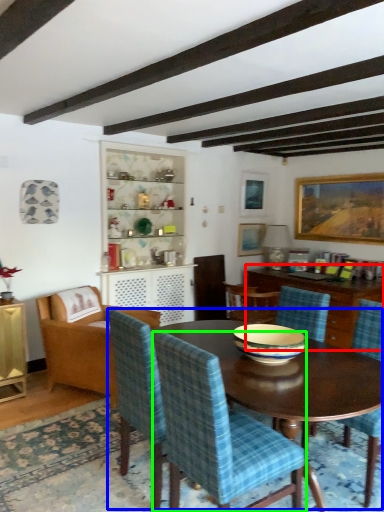
Question: Based on their relative distances, which object is nearer to cabinetry (highlighted by a red box)? Choose from kitchen & dining room table (highlighted by a blue box) and chair (highlighted by a green box).

Choices:
 (A) kitchen & dining room table
 (B) chair

Answer: (A)